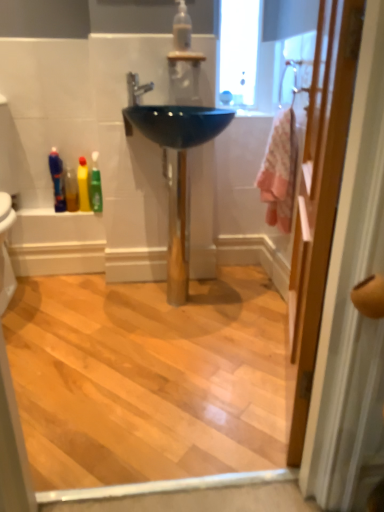
Question: Can you confirm if glossy ceramic sink at center is positioned to the right of pink fabric at right?

Choices:
 (A) no
 (B) yes

Answer: (A)

Question: From the image's perspective, is glossy ceramic sink at center on pink fabric at right?

Choices:
 (A) no
 (B) yes

Answer: (B)

Question: From a real-world perspective, is glossy ceramic sink at center on pink fabric at right?

Choices:
 (A) no
 (B) yes

Answer: (A)

Question: Considering the relative sizes of glossy ceramic sink at center and pink fabric at right in the image provided, is glossy ceramic sink at center bigger than pink fabric at right?

Choices:
 (A) no
 (B) yes

Answer: (B)

Question: Is glossy ceramic sink at center shorter than pink fabric at right?

Choices:
 (A) no
 (B) yes

Answer: (B)

Question: From a real-world perspective, relative to pink fabric at right, is green plastic toothpaste tube at left, marked as the first toiletry in a right-to-left arrangement, vertically above or below?

Choices:
 (A) above
 (B) below

Answer: (B)

Question: Is green plastic toothpaste tube at left, positioned as the 3th toiletry in left-to-right order, bigger or smaller than pink fabric at right?

Choices:
 (A) small
 (B) big

Answer: (A)

Question: In terms of height, does green plastic toothpaste tube at left, marked as the first toiletry in a right-to-left arrangement, look taller or shorter compared to pink fabric at right?

Choices:
 (A) tall
 (B) short

Answer: (B)

Question: From the image's perspective, relative to pink fabric at right, is green plastic toothpaste tube at left, marked as the first toiletry in a right-to-left arrangement, above or below?

Choices:
 (A) below
 (B) above

Answer: (B)

Question: Based on their sizes in the image, would you say yellow matte bottle at lower left, placed as the second toiletry when sorted from left to right, is bigger or smaller than green plastic toothpaste tube at left, marked as the first toiletry in a right-to-left arrangement?

Choices:
 (A) small
 (B) big

Answer: (A)

Question: Considering the positions of yellow matte bottle at lower left, placed as the second toiletry when sorted from left to right, and green plastic toothpaste tube at left, positioned as the 3th toiletry in left-to-right order, in the image, is yellow matte bottle at lower left, placed as the second toiletry when sorted from left to right, taller or shorter than green plastic toothpaste tube at left, positioned as the 3th toiletry in left-to-right order,?

Choices:
 (A) short
 (B) tall

Answer: (A)

Question: Is yellow matte bottle at lower left, which ranks as the second toiletry in right-to-left order, wider or thinner than green plastic toothpaste tube at left, marked as the first toiletry in a right-to-left arrangement?

Choices:
 (A) wide
 (B) thin

Answer: (A)

Question: From the image's perspective, is yellow matte bottle at lower left, placed as the second toiletry when sorted from left to right, located above or below green plastic toothpaste tube at left, marked as the first toiletry in a right-to-left arrangement?

Choices:
 (A) below
 (B) above

Answer: (A)

Question: From a real-world perspective, is matte white shower at upper right above or below pink fabric at right?

Choices:
 (A) below
 (B) above

Answer: (B)

Question: Would you say matte white shower at upper right is to the left or to the right of pink fabric at right in the picture?

Choices:
 (A) left
 (B) right

Answer: (B)